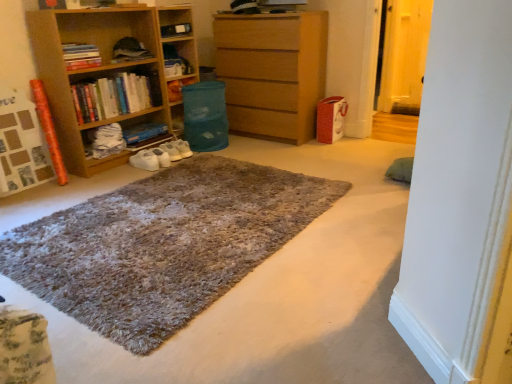
Question: Can you confirm if hardcover books at left, which is the second book in bottom-to-top order, is positioned to the left of hardcover books at left, which is counted as the 3th book, starting from the bottom?

Choices:
 (A) no
 (B) yes

Answer: (A)

Question: Would you consider hardcover books at left, which is the second book in bottom-to-top order, to be distant from hardcover books at left, marked as the first book in a top-to-bottom arrangement?

Choices:
 (A) no
 (B) yes

Answer: (A)

Question: Could you tell me if hardcover books at left, the second book viewed from the top, is turned towards hardcover books at left, which is counted as the 3th book, starting from the bottom?

Choices:
 (A) yes
 (B) no

Answer: (B)

Question: Considering the relative sizes of hardcover books at left, the second book viewed from the top, and hardcover books at left, marked as the first book in a top-to-bottom arrangement, in the image provided, is hardcover books at left, the second book viewed from the top, shorter than hardcover books at left, marked as the first book in a top-to-bottom arrangement,?

Choices:
 (A) yes
 (B) no

Answer: (B)

Question: Considering the relative sizes of hardcover books at left, the second book viewed from the top, and hardcover books at left, marked as the first book in a top-to-bottom arrangement, in the image provided, is hardcover books at left, the second book viewed from the top, thinner than hardcover books at left, marked as the first book in a top-to-bottom arrangement,?

Choices:
 (A) no
 (B) yes

Answer: (A)

Question: From a real-world perspective, relative to hardcover books at left, the second book viewed from the top, is blue cardboard book at center, arranged as the 1th book when ordered from the bottom, vertically above or below?

Choices:
 (A) above
 (B) below

Answer: (B)

Question: From the image's perspective, is blue cardboard book at center, arranged as the 1th book when ordered from the bottom, positioned above or below hardcover books at left, the second book viewed from the top?

Choices:
 (A) above
 (B) below

Answer: (B)

Question: From their relative heights in the image, would you say blue cardboard book at center, placed as the 3th book when sorted from top to bottom, is taller or shorter than hardcover books at left, which is the second book in bottom-to-top order?

Choices:
 (A) short
 (B) tall

Answer: (A)

Question: Considering their positions, is blue cardboard book at center, arranged as the 1th book when ordered from the bottom, located in front of or behind hardcover books at left, the second book viewed from the top?

Choices:
 (A) front
 (B) behind

Answer: (B)

Question: Does point (259, 264) appear closer or farther from the camera than point (146, 135)?

Choices:
 (A) farther
 (B) closer

Answer: (B)

Question: From the image's perspective, is shaggy carpet at center located above or below blue cardboard book at center, placed as the 3th book when sorted from top to bottom?

Choices:
 (A) above
 (B) below

Answer: (B)

Question: From a real-world perspective, is shaggy carpet at center above or below blue cardboard book at center, arranged as the 1th book when ordered from the bottom?

Choices:
 (A) above
 (B) below

Answer: (B)

Question: Is shaggy carpet at center taller or shorter than blue cardboard book at center, placed as the 3th book when sorted from top to bottom?

Choices:
 (A) short
 (B) tall

Answer: (A)

Question: In the image, is hardcover books at left, the second book viewed from the top, on the left side or the right side of shaggy carpet at center?

Choices:
 (A) left
 (B) right

Answer: (A)

Question: Relative to shaggy carpet at center, is hardcover books at left, the second book viewed from the top, in front or behind?

Choices:
 (A) front
 (B) behind

Answer: (B)